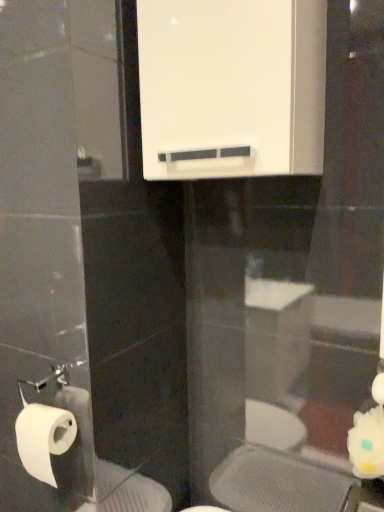
Question: Should I look upward or downward to see white matte toilet paper at lower left?

Choices:
 (A) down
 (B) up

Answer: (A)

Question: Considering the relative positions of white glossy medicine cabinet at upper center and white matte toilet paper at lower left in the image provided, is white glossy medicine cabinet at upper center to the right of white matte toilet paper at lower left from the viewer's perspective?

Choices:
 (A) no
 (B) yes

Answer: (B)

Question: Considering the relative sizes of white glossy medicine cabinet at upper center and white matte toilet paper at lower left in the image provided, is white glossy medicine cabinet at upper center thinner than white matte toilet paper at lower left?

Choices:
 (A) no
 (B) yes

Answer: (A)

Question: From a real-world perspective, is white glossy medicine cabinet at upper center below white matte toilet paper at lower left?

Choices:
 (A) yes
 (B) no

Answer: (B)

Question: Is white glossy medicine cabinet at upper center at the left side of white matte toilet paper at lower left?

Choices:
 (A) yes
 (B) no

Answer: (B)

Question: Can we say white glossy medicine cabinet at upper center lies outside white matte toilet paper at lower left?

Choices:
 (A) yes
 (B) no

Answer: (A)

Question: Does white glossy medicine cabinet at upper center touch white matte toilet paper at lower left?

Choices:
 (A) no
 (B) yes

Answer: (A)

Question: From the image's perspective, would you say white matte toilet paper at lower left is positioned over white glossy medicine cabinet at upper center?

Choices:
 (A) no
 (B) yes

Answer: (A)

Question: From the image's perspective, is white matte toilet paper at lower left beneath white glossy medicine cabinet at upper center?

Choices:
 (A) no
 (B) yes

Answer: (B)

Question: Is white matte toilet paper at lower left at the right side of white glossy medicine cabinet at upper center?

Choices:
 (A) no
 (B) yes

Answer: (A)

Question: Does white matte toilet paper at lower left have a greater width compared to white glossy medicine cabinet at upper center?

Choices:
 (A) yes
 (B) no

Answer: (B)

Question: Considering the relative sizes of white matte toilet paper at lower left and white glossy medicine cabinet at upper center in the image provided, is white matte toilet paper at lower left taller than white glossy medicine cabinet at upper center?

Choices:
 (A) no
 (B) yes

Answer: (A)

Question: Can you confirm if white matte toilet paper at lower left is thinner than white glossy medicine cabinet at upper center?

Choices:
 (A) yes
 (B) no

Answer: (A)

Question: From a real-world perspective, is white matte toilet paper at lower left above or below white glossy medicine cabinet at upper center?

Choices:
 (A) below
 (B) above

Answer: (A)